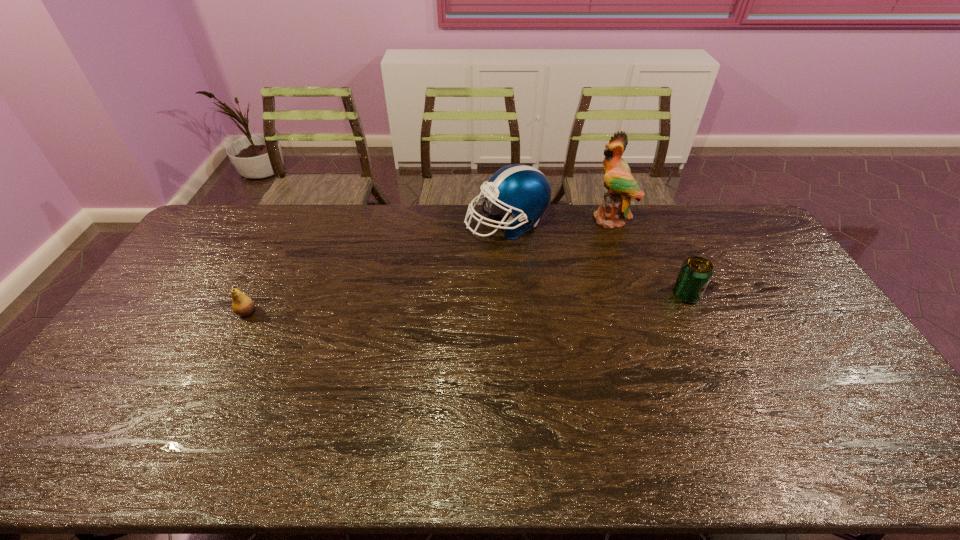
Select which object is the second closest to the second object from right to left. Please provide its 2D coordinates. Your answer should be formatted as a tuple, i.e. [(x, y)], where the tuple contains the x and y coordinates of a point satisfying the conditions above.

[(694, 276)]

This screenshot has width=960, height=540. In order to click on the closest object to the second tallest object in this screenshot , I will do `click(621, 186)`.

What are the coordinates of `free space that satisfies the following two spatial constraints: 1. on the back side of the tallest object; 2. on the left side of the football helmet` in the screenshot? It's located at (506, 218).

Where is `free location that satisfies the following two spatial constraints: 1. on the back side of the third object from right to left; 2. on the left side of the pear`? The image size is (960, 540). free location that satisfies the following two spatial constraints: 1. on the back side of the third object from right to left; 2. on the left side of the pear is located at coordinates (292, 224).